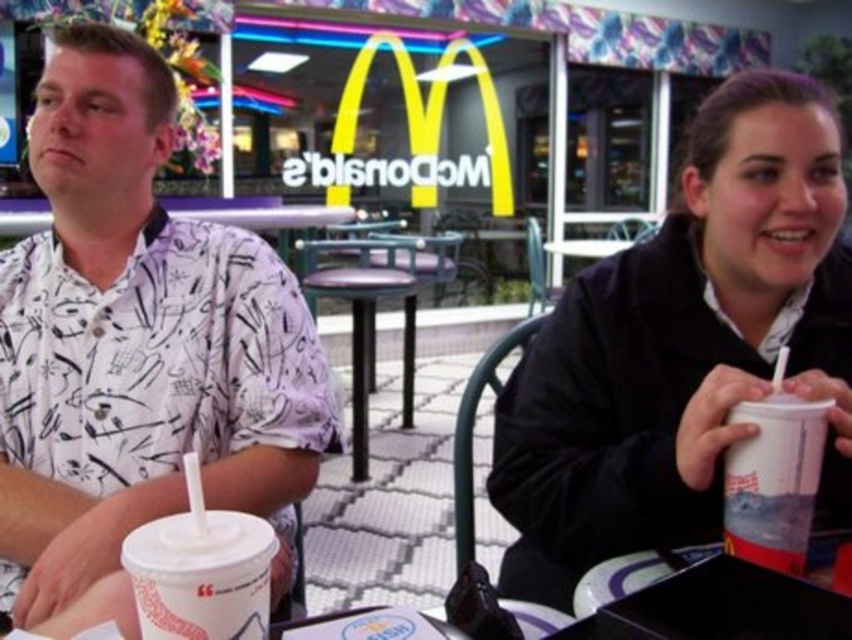
Question: Which point is closer to the camera?

Choices:
 (A) (783, 476)
 (B) (232, 524)

Answer: (B)

Question: Which of the following is the closest to the observer?

Choices:
 (A) white paper cup at lower left
 (B) translucent plastic cup at center

Answer: (A)

Question: Does translucent plastic cup at center appear over white paper cup at right?

Choices:
 (A) no
 (B) yes

Answer: (B)

Question: Which point appears closest to the camera in this image?

Choices:
 (A) (556, 387)
 (B) (162, 624)
 (C) (730, 550)
 (D) (278, 321)

Answer: (B)

Question: Is white printed shirt at left below white paper cup at right?

Choices:
 (A) yes
 (B) no

Answer: (B)

Question: Is translucent plastic cup at center closer to the viewer compared to white paper cup at lower left?

Choices:
 (A) yes
 (B) no

Answer: (B)